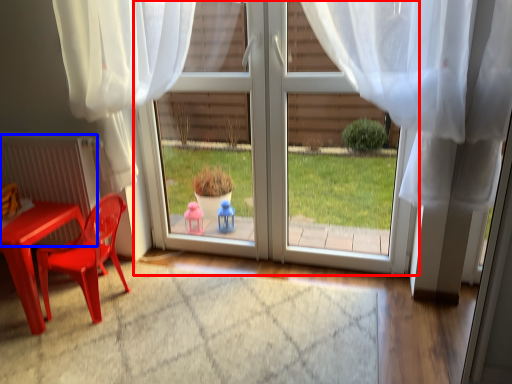
Question: Which of the following is the farthest to the observer, door (highlighted by a red box) or radiator (highlighted by a blue box)?

Choices:
 (A) door
 (B) radiator

Answer: (B)